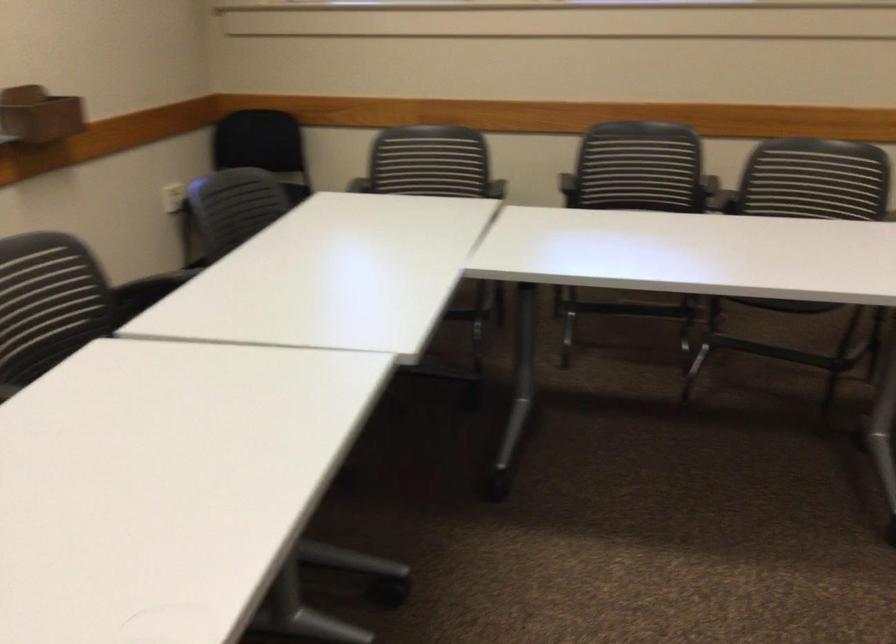
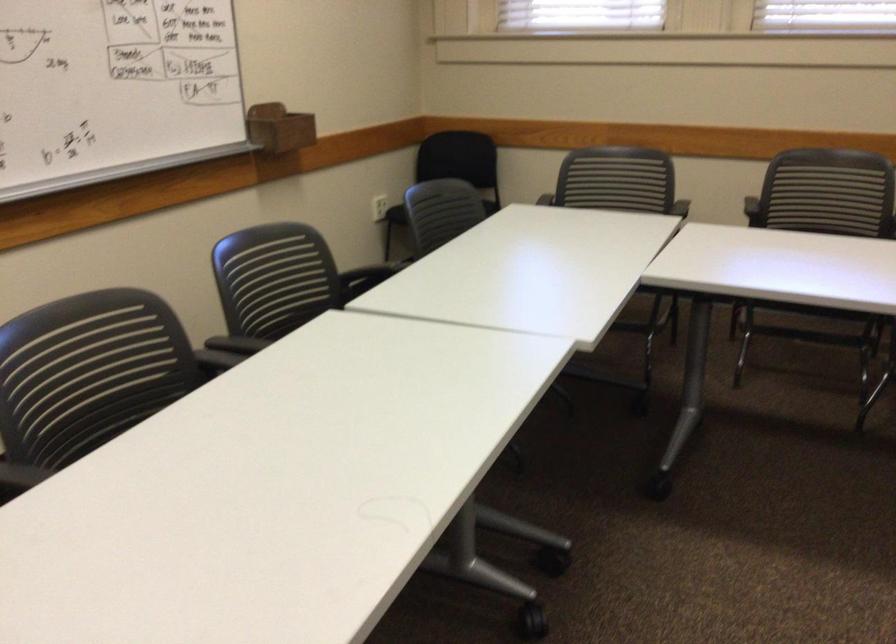
Locate, in the second image, the point that corresponds to point (498, 196) in the first image.

(678, 212)